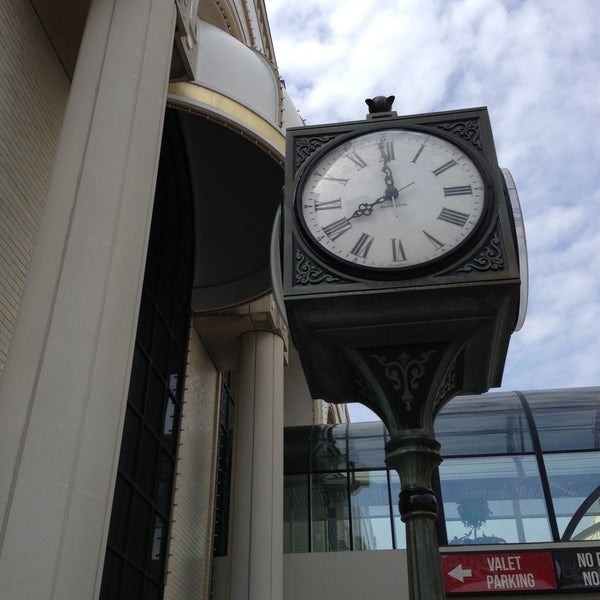
The image size is (600, 600). I want to click on glass, so click(x=512, y=494).